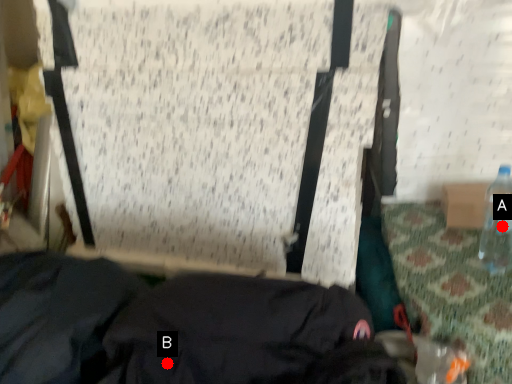
Question: Two points are circled on the image, labeled by A and B beside each circle. Among these points, which one is farthest from the camera?

Choices:
 (A) A is further
 (B) B is further

Answer: (A)